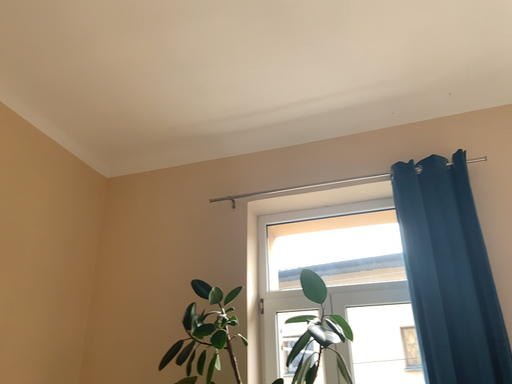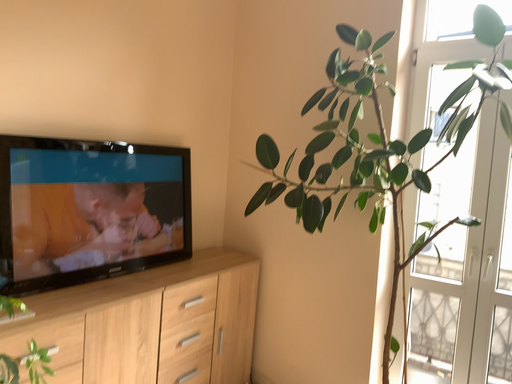
Question: How did the camera likely rotate when shooting the video?

Choices:
 (A) rotated upward
 (B) rotated downward

Answer: (B)